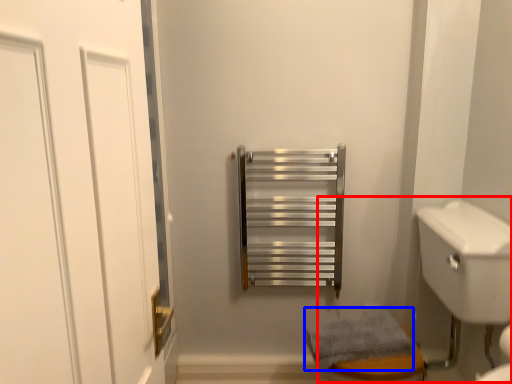
Question: Which point is closer to the camera, sink (highlighted by a red box) or bath towel (highlighted by a blue box)?

Choices:
 (A) sink
 (B) bath towel

Answer: (A)